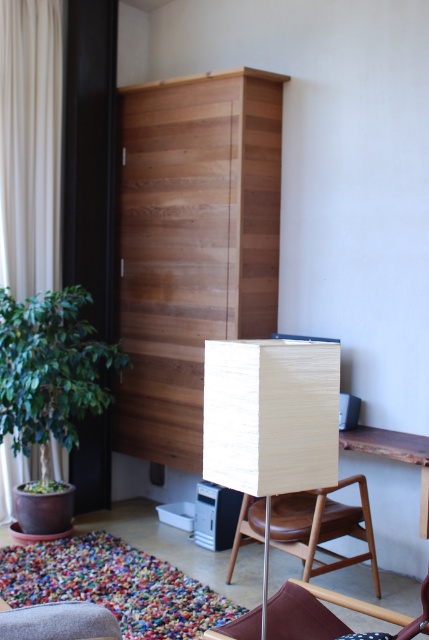
You are sitting in the wooden armchair at center and want to get up to reach the window. Do you need to move the velvet burgundy armchair at lower center out of the way first?

The velvet burgundy armchair at lower center is behind the wooden armchair at center, so you do not need to move it to reach the window.

You are planning to place a 2.5 feet wide decorative item on the floor between the wooden armchair at center and the velvet burgundy armchair at lower center. Considering their widths, will there be enough space for the item to fit comfortably without touching either chair?

The wooden armchair at center is wider than the velvet burgundy armchair at lower center. Since the decorative item is 2.5 feet wide, the space between them must be at least 2.5 feet plus the combined widths of both chairs to ensure it doesn

Based on the photo, you are sitting in the velvet burgundy armchair at lower center and want to reach the beige fabric curtain at left. Which direction should you move to get closer to the curtain?

You should move forward because the beige fabric curtain at left is further to the viewer than the velvet burgundy armchair at lower center, meaning the curtain is closer to you than the armchair is.